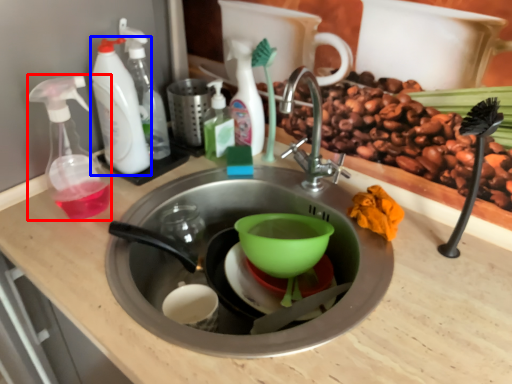
Question: Which object appears closest to the camera in this image, soap dispenser (highlighted by a red box) or cleaning product (highlighted by a blue box)?

Choices:
 (A) soap dispenser
 (B) cleaning product

Answer: (A)